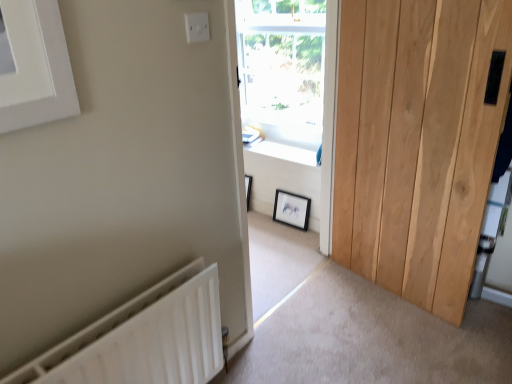
Question: Can you confirm if transparent glass window at center is thinner than black matte picture frame at center?

Choices:
 (A) yes
 (B) no

Answer: (B)

Question: Is transparent glass window at center wider than black matte picture frame at center?

Choices:
 (A) yes
 (B) no

Answer: (A)

Question: From a real-world perspective, is transparent glass window at center on black matte picture frame at center?

Choices:
 (A) no
 (B) yes

Answer: (B)

Question: Is there a large distance between transparent glass window at center and black matte picture frame at center?

Choices:
 (A) yes
 (B) no

Answer: (B)

Question: Considering the relative sizes of transparent glass window at center and black matte picture frame at center in the image provided, is transparent glass window at center shorter than black matte picture frame at center?

Choices:
 (A) yes
 (B) no

Answer: (B)

Question: Is black matte picture frame at center bigger or smaller than white wood window frame at center?

Choices:
 (A) small
 (B) big

Answer: (A)

Question: In the image, is black matte picture frame at center on the left side or the right side of white wood window frame at center?

Choices:
 (A) left
 (B) right

Answer: (B)

Question: Relative to white wood window frame at center, is black matte picture frame at center in front or behind?

Choices:
 (A) front
 (B) behind

Answer: (B)

Question: In terms of height, does black matte picture frame at center look taller or shorter compared to white wood window frame at center?

Choices:
 (A) short
 (B) tall

Answer: (A)

Question: Would you say transparent glass window at center is to the left or to the right of black matte picture frame at center in the picture?

Choices:
 (A) left
 (B) right

Answer: (A)

Question: In the image, is transparent glass window at center positioned in front of or behind black matte picture frame at center?

Choices:
 (A) behind
 (B) front

Answer: (B)

Question: From the image's perspective, relative to black matte picture frame at center, is transparent glass window at center above or below?

Choices:
 (A) below
 (B) above

Answer: (B)

Question: From their relative heights in the image, would you say transparent glass window at center is taller or shorter than black matte picture frame at center?

Choices:
 (A) tall
 (B) short

Answer: (A)

Question: From a real-world perspective, is natural wood door at right above or below white wood window frame at center?

Choices:
 (A) below
 (B) above

Answer: (A)

Question: Is natural wood door at right in front of or behind white wood window frame at center in the image?

Choices:
 (A) behind
 (B) front

Answer: (B)